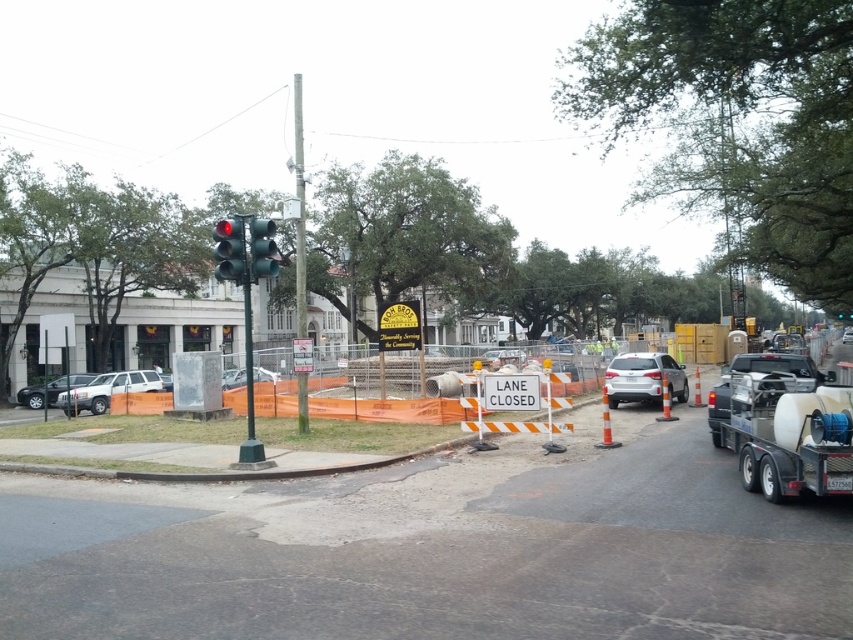
Which is more to the right, orange plastic barrier at center or satin silver sedan at center?

satin silver sedan at center is more to the right.

Is orange plastic barrier at center bigger than satin silver sedan at center?

Yes.

Is point (514, 515) farther from camera compared to point (489, 355)?

No, it is not.

You are a GUI agent. You are given a task and a screenshot of the screen. Output one action in this format:
    pyautogui.click(x=<x>, y=<y>)
    Task: Click on the orange plastic barrier at center
    
    Given the screenshot: What is the action you would take?
    pyautogui.click(x=436, y=548)

Looking at this image, who is more distant from viewer, [715,435] or [271,241]?

The point [715,435] is behind.

Which is below, white matte truck at right or green matte traffic light at upper left?

white matte truck at right is below.

Who is more distant from viewer, (724, 378) or (271, 220)?

Positioned behind is point (724, 378).

Image resolution: width=853 pixels, height=640 pixels. Identify the location of white matte truck at right. (756, 371).

Is silver metallic suv at left positioned in front of green matte traffic light at upper left?

No, it is behind green matte traffic light at upper left.

Identify the location of silver metallic suv at left. (107, 390).

Identify the location of silver metallic suv at left. This screenshot has height=640, width=853. (107, 390).